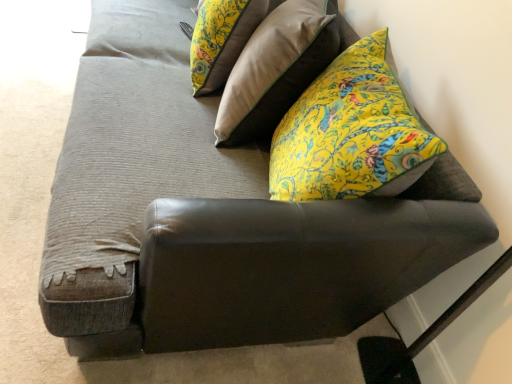
Question: Is floral fabric pillow at upper center, arranged as the 1th pillow when viewed from the left, surrounding floral yellow pillow at upper right, arranged as the second pillow when viewed from the left?

Choices:
 (A) no
 (B) yes

Answer: (A)

Question: From the image's perspective, does floral fabric pillow at upper center, which is counted as the 2th pillow, starting from the right, appear lower than floral yellow pillow at upper right, arranged as the second pillow when viewed from the left?

Choices:
 (A) no
 (B) yes

Answer: (A)

Question: Does floral fabric pillow at upper center, arranged as the 1th pillow when viewed from the left, touch floral yellow pillow at upper right, arranged as the second pillow when viewed from the left?

Choices:
 (A) no
 (B) yes

Answer: (A)

Question: Considering the relative sizes of floral fabric pillow at upper center, arranged as the 1th pillow when viewed from the left, and floral yellow pillow at upper right, arranged as the second pillow when viewed from the left, in the image provided, is floral fabric pillow at upper center, arranged as the 1th pillow when viewed from the left, thinner than floral yellow pillow at upper right, arranged as the second pillow when viewed from the left,?

Choices:
 (A) yes
 (B) no

Answer: (A)

Question: Is floral fabric pillow at upper center, which is counted as the 2th pillow, starting from the right, far from floral yellow pillow at upper right, arranged as the second pillow when viewed from the left?

Choices:
 (A) no
 (B) yes

Answer: (A)

Question: Is floral fabric pillow at upper center, arranged as the 1th pillow when viewed from the left, wider than floral yellow pillow at upper right, placed as the first pillow when sorted from right to left?

Choices:
 (A) yes
 (B) no

Answer: (B)

Question: Is floral yellow pillow at upper right, placed as the first pillow when sorted from right to left, next to floral fabric pillow at upper center, which is counted as the 2th pillow, starting from the right?

Choices:
 (A) no
 (B) yes

Answer: (A)

Question: From the image's perspective, is floral yellow pillow at upper right, arranged as the second pillow when viewed from the left, above floral fabric pillow at upper center, which is counted as the 2th pillow, starting from the right?

Choices:
 (A) no
 (B) yes

Answer: (A)

Question: Does floral yellow pillow at upper right, placed as the first pillow when sorted from right to left, turn towards floral fabric pillow at upper center, arranged as the 1th pillow when viewed from the left?

Choices:
 (A) yes
 (B) no

Answer: (A)

Question: From a real-world perspective, is floral yellow pillow at upper right, placed as the first pillow when sorted from right to left, on top of floral fabric pillow at upper center, which is counted as the 2th pillow, starting from the right?

Choices:
 (A) yes
 (B) no

Answer: (A)

Question: From the image's perspective, would you say floral yellow pillow at upper right, arranged as the second pillow when viewed from the left, is shown under floral fabric pillow at upper center, arranged as the 1th pillow when viewed from the left?

Choices:
 (A) no
 (B) yes

Answer: (B)

Question: Can you confirm if floral yellow pillow at upper right, placed as the first pillow when sorted from right to left, is taller than floral fabric pillow at upper center, which is counted as the 2th pillow, starting from the right?

Choices:
 (A) no
 (B) yes

Answer: (B)

Question: From their relative heights in the image, would you say floral fabric pillow at upper center, arranged as the 1th pillow when viewed from the left, is taller or shorter than floral yellow pillow at upper right, arranged as the second pillow when viewed from the left?

Choices:
 (A) short
 (B) tall

Answer: (A)